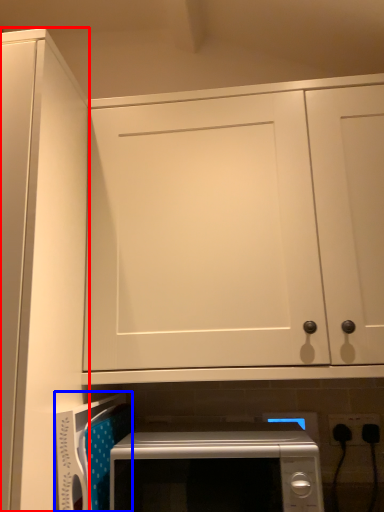
Question: Which object is closer to the camera taking this photo, door (highlighted by a red box) or appliance (highlighted by a blue box)?

Choices:
 (A) door
 (B) appliance

Answer: (A)